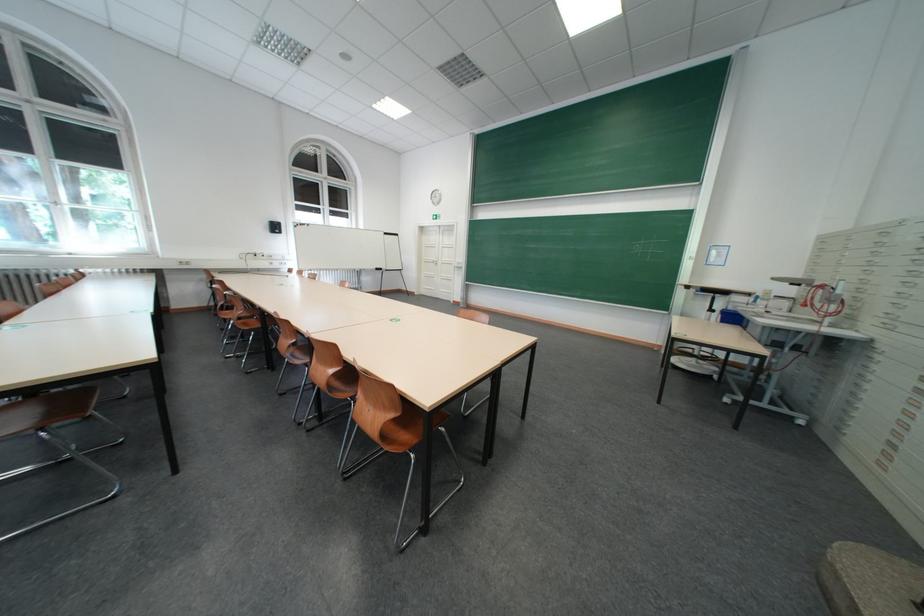
Image resolution: width=924 pixels, height=616 pixels. What do you see at coordinates (446, 270) in the screenshot?
I see `the white door handle` at bounding box center [446, 270].